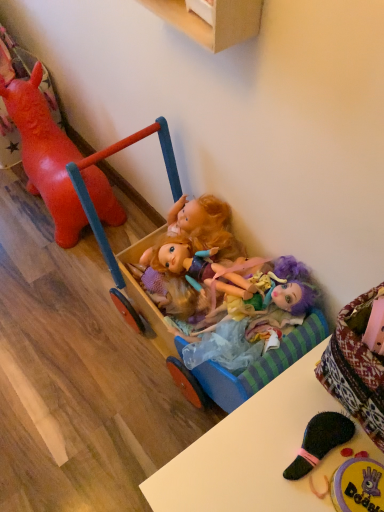
This screenshot has width=384, height=512. I want to click on free space to the back side of plush purple doll at lower right, acting as the first toy starting from the bottom, so tap(314, 415).